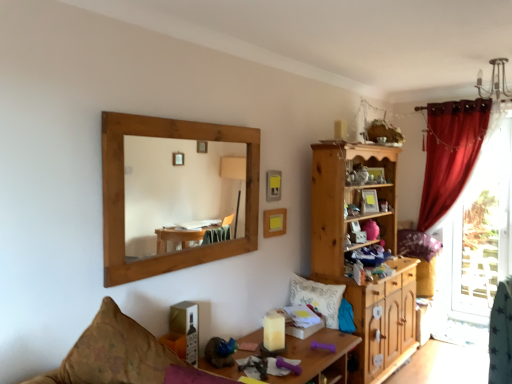
Question: Which direction should I rotate to look at white textured pillow at center, which ranks as the 2th pillow in right-to-left order?

Choices:
 (A) right
 (B) left

Answer: (A)

Question: Can you confirm if wooden mirror at upper left is taller than wooden cabinet at center-right?

Choices:
 (A) yes
 (B) no

Answer: (B)

Question: Is wooden mirror at upper left positioned in front of wooden cabinet at center-right?

Choices:
 (A) yes
 (B) no

Answer: (A)

Question: Would you say wooden mirror at upper left is outside wooden cabinet at center-right?

Choices:
 (A) yes
 (B) no

Answer: (A)

Question: Can you confirm if wooden mirror at upper left is positioned to the right of wooden cabinet at center-right?

Choices:
 (A) no
 (B) yes

Answer: (A)

Question: Is wooden mirror at upper left smaller than wooden cabinet at center-right?

Choices:
 (A) yes
 (B) no

Answer: (A)

Question: Is wooden mirror at upper left further to camera compared to wooden cabinet at center-right?

Choices:
 (A) no
 (B) yes

Answer: (A)

Question: Could yellow matte picture frame at upper center, placed as the second picture frame when sorted from top to bottom, be considered to be inside patterned fabric couch at lower left?

Choices:
 (A) no
 (B) yes

Answer: (A)

Question: Can you confirm if patterned fabric couch at lower left is taller than yellow matte picture frame at upper center, which appears as the 1th picture frame when ordered from the bottom?

Choices:
 (A) yes
 (B) no

Answer: (A)

Question: Is patterned fabric couch at lower left not close to yellow matte picture frame at upper center, which appears as the 1th picture frame when ordered from the bottom?

Choices:
 (A) no
 (B) yes

Answer: (B)

Question: Can you confirm if patterned fabric couch at lower left is positioned to the left of yellow matte picture frame at upper center, which appears as the 1th picture frame when ordered from the bottom?

Choices:
 (A) no
 (B) yes

Answer: (B)

Question: Does patterned fabric couch at lower left have a lesser height compared to yellow matte picture frame at upper center, placed as the second picture frame when sorted from top to bottom?

Choices:
 (A) no
 (B) yes

Answer: (A)

Question: Is patterned fabric couch at lower left at the right side of yellow matte picture frame at upper center, placed as the second picture frame when sorted from top to bottom?

Choices:
 (A) no
 (B) yes

Answer: (A)

Question: Can you confirm if patterned fabric couch at lower left is smaller than matte yellow picture frame at upper center, which appears as the second picture frame when ordered from the bottom?

Choices:
 (A) no
 (B) yes

Answer: (A)